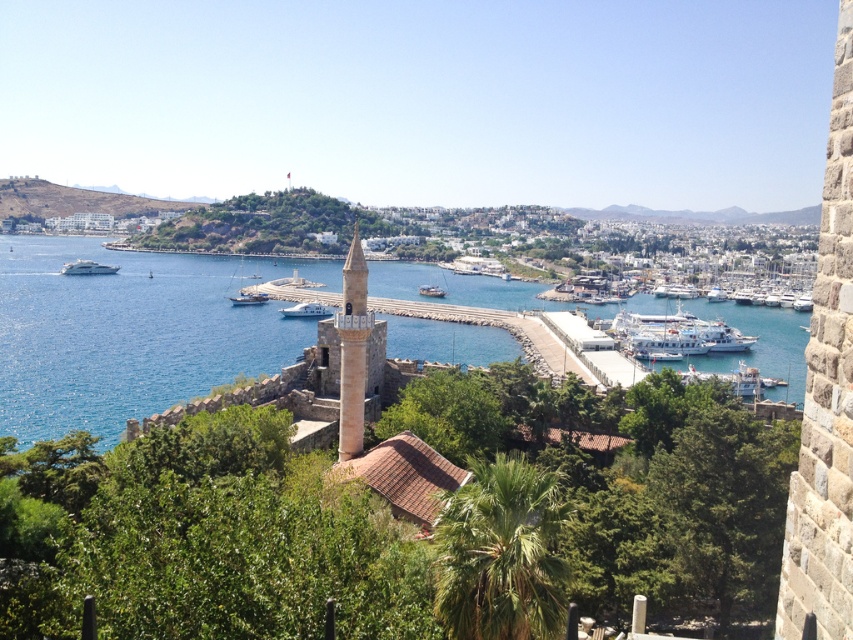
Question: Is light brown stone tower at center above white glossy boat at center?

Choices:
 (A) no
 (B) yes

Answer: (A)

Question: Which object is positioned closest to the white glossy boat at center?

Choices:
 (A) light brown stone tower at center
 (B) dark blue wooden boat at center
 (C) white glossy yacht at left
 (D) blue water at center

Answer: (B)

Question: Among these points, which one is farthest from the camera?

Choices:
 (A) (660, 348)
 (B) (306, 314)

Answer: (B)

Question: Can you confirm if blue water at center is positioned to the left of white glossy boat at center?

Choices:
 (A) yes
 (B) no

Answer: (A)

Question: Does blue water at center appear over white glossy yacht at left?

Choices:
 (A) no
 (B) yes

Answer: (B)

Question: Which object appears farthest from the camera in this image?

Choices:
 (A) white glossy boat at center
 (B) white glossy boat at center-right
 (C) blue water at center

Answer: (A)